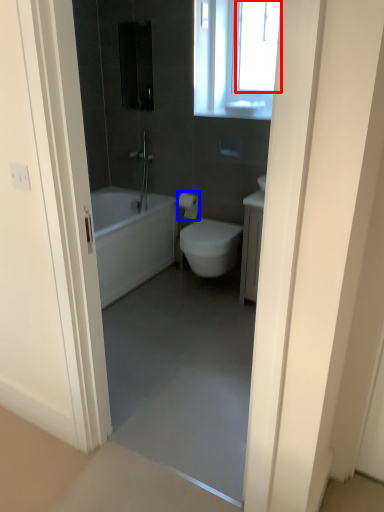
Question: Which object is closer to the camera taking this photo, window screen (highlighted by a red box) or toilet paper (highlighted by a blue box)?

Choices:
 (A) window screen
 (B) toilet paper

Answer: (A)